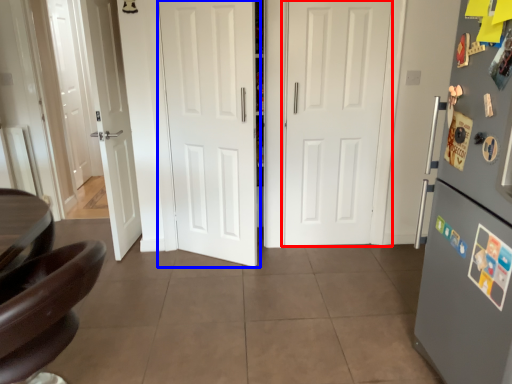
Question: Which point is closer to the camera, door (highlighted by a red box) or door (highlighted by a blue box)?

Choices:
 (A) door
 (B) door

Answer: (B)